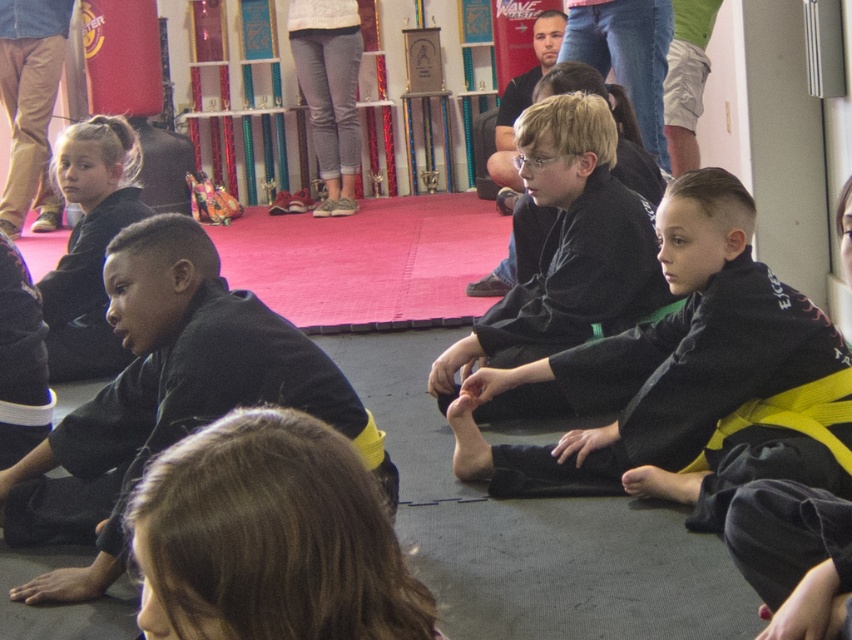
You are a photographer standing in the corner of the room. You need to take a photo of the black matte karate gi at left and the matte black karate gi at left. Which one is positioned lower in the image?

The black matte karate gi at left is positioned lower than the matte black karate gi at left in the image.